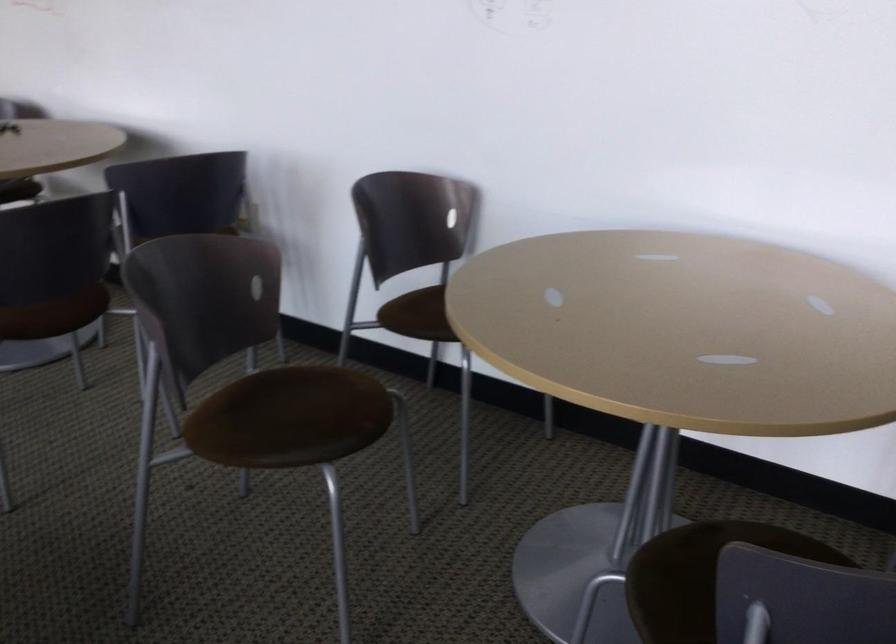
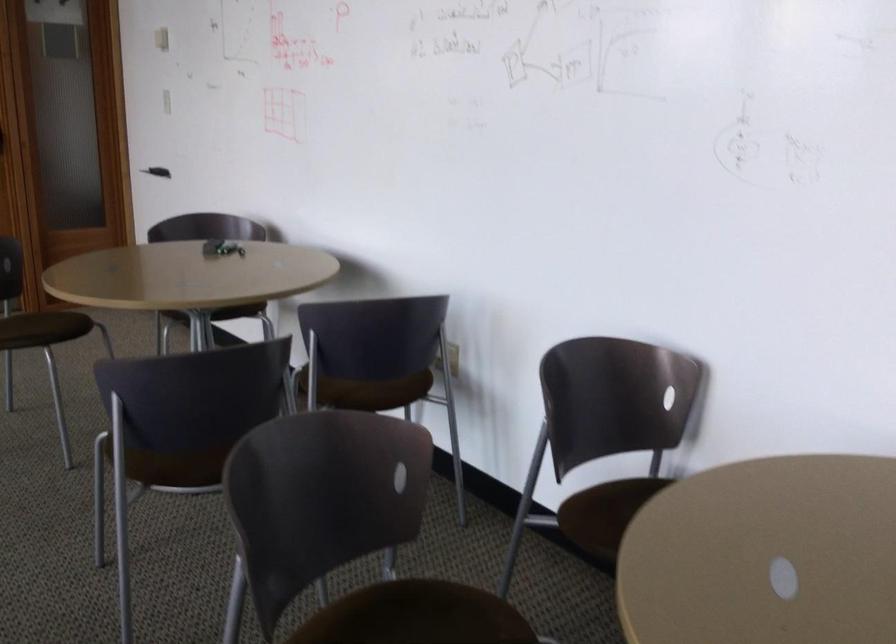
The point at (416, 314) is marked in the first image. Where is the corresponding point in the second image?

(595, 514)